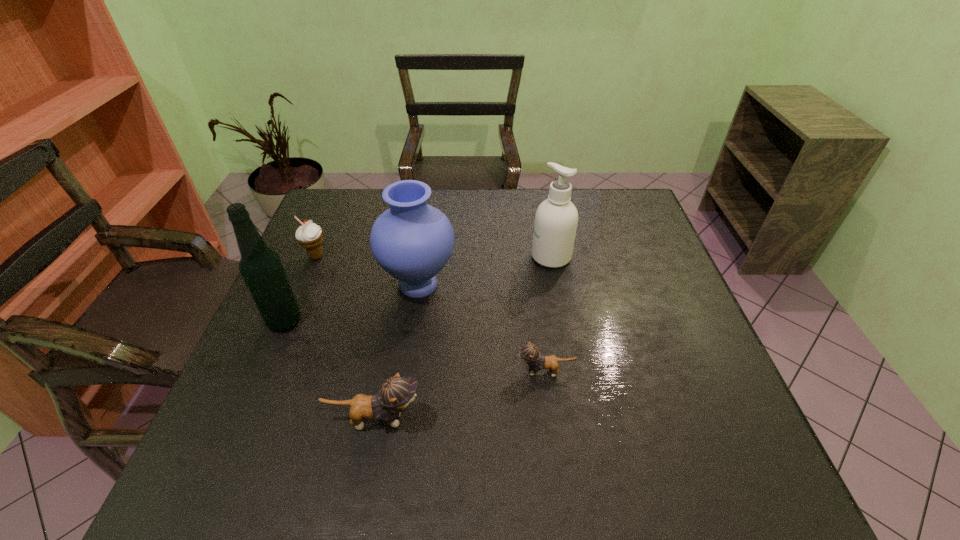
The image size is (960, 540). In order to click on icecream that is at the left edge in this screenshot , I will do `click(309, 235)`.

Find the location of a particular element. vacant space at the far edge of the desktop is located at coordinates (471, 217).

The image size is (960, 540). I want to click on free location at the near edge, so click(x=505, y=416).

The image size is (960, 540). In the image, there is a desktop. What are the coordinates of `vacant area at the left edge` in the screenshot? It's located at (256, 391).

The image size is (960, 540). What are the coordinates of `vacant space at the right edge of the desktop` in the screenshot? It's located at (669, 290).

Where is `free spot at the far left corner of the desktop`? free spot at the far left corner of the desktop is located at coordinates (367, 215).

Where is `free region at the far right corner of the desktop`? The width and height of the screenshot is (960, 540). free region at the far right corner of the desktop is located at coordinates (612, 192).

At what (x,y) coordinates should I click in order to perform the action: click on vacant area that lies between the shorter kitten and the vase. Please return your answer as a coordinate pair (x, y). The height and width of the screenshot is (540, 960). Looking at the image, I should click on (481, 328).

At what (x,y) coordinates should I click in order to perform the action: click on free area in between the nearer kitten and the icecream. Please return your answer as a coordinate pair (x, y). Image resolution: width=960 pixels, height=540 pixels. Looking at the image, I should click on (346, 338).

Locate an element on the screen. The image size is (960, 540). free space between the vase and the farther kitten is located at coordinates (481, 328).